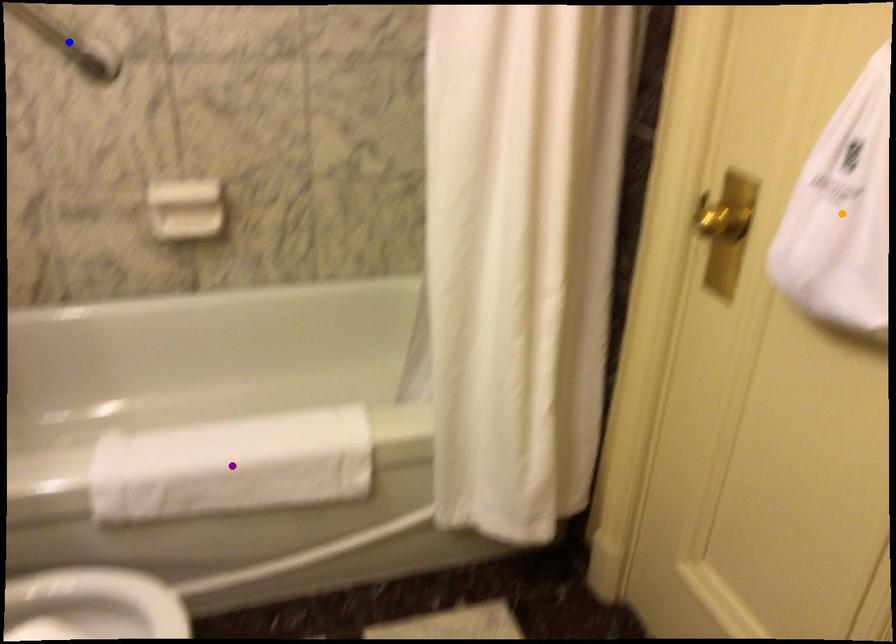
Order these from farthest to nearest:
blue point
orange point
purple point

blue point, purple point, orange point